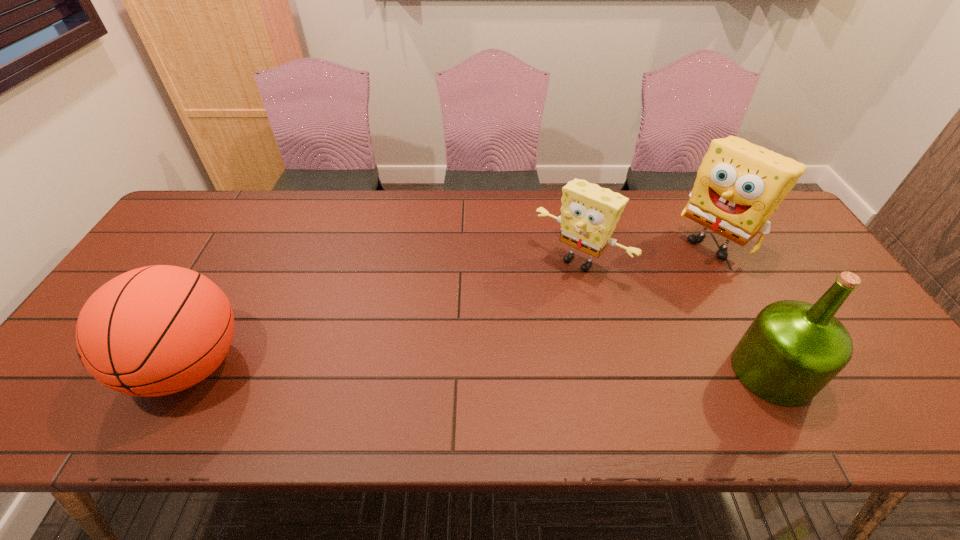
Where is `free space located on the face of the second object from left to right`? The image size is (960, 540). free space located on the face of the second object from left to right is located at coordinates (524, 317).

This screenshot has height=540, width=960. I want to click on free location located on the face of the right sponge, so click(618, 324).

Identify the location of vacant area situated 0.050m on the face of the right sponge. (684, 268).

Identify the location of vacant space situated 0.310m on the face of the right sponge. (630, 314).

The height and width of the screenshot is (540, 960). In order to click on object located in the far edge section of the desktop in this screenshot , I will do `click(739, 185)`.

Locate an element on the screen. basketball at the near edge is located at coordinates (156, 330).

The image size is (960, 540). Identify the location of olive oil at the near edge. (792, 349).

Find the location of a particular element. Image resolution: width=960 pixels, height=540 pixels. object that is positioned at the left edge is located at coordinates (156, 330).

You are a GUI agent. You are given a task and a screenshot of the screen. Output one action in this format:
    pyautogui.click(x=<x>, y=<y>)
    Task: Click on the object that is at the right edge
    The image size is (960, 540).
    Given the screenshot: What is the action you would take?
    pyautogui.click(x=739, y=185)

This screenshot has width=960, height=540. What are the coordinates of `object located at the near left corner` in the screenshot? It's located at (156, 330).